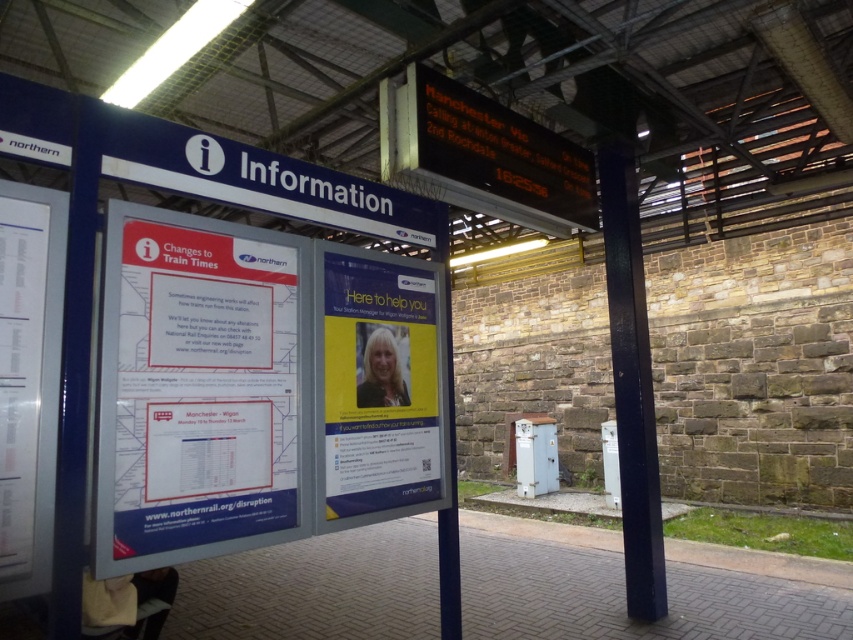
Is yellow paper poster at center wider than smooth dark blue pole at right?

Indeed, yellow paper poster at center has a greater width compared to smooth dark blue pole at right.

Can you confirm if yellow paper poster at center is positioned below smooth dark blue pole at right?

Actually, yellow paper poster at center is above smooth dark blue pole at right.

Which is behind, point (340, 467) or point (647, 577)?

Positioned behind is point (647, 577).

Where is `yellow paper poster at center`? yellow paper poster at center is located at coordinates (378, 387).

Is white paper poster at center below white paper at left?

Yes, white paper poster at center is below white paper at left.

Is point (167, 528) less distant than point (33, 323)?

That is False.

Identify the location of white paper poster at center. This screenshot has height=640, width=853. (202, 388).

Is smooth dark blue pole at right closer to the viewer compared to white paper at left?

No, it is behind white paper at left.

Which is behind, point (631, 516) or point (22, 442)?

Point (631, 516)

Locate an element on the screen. The image size is (853, 640). smooth dark blue pole at right is located at coordinates (631, 384).